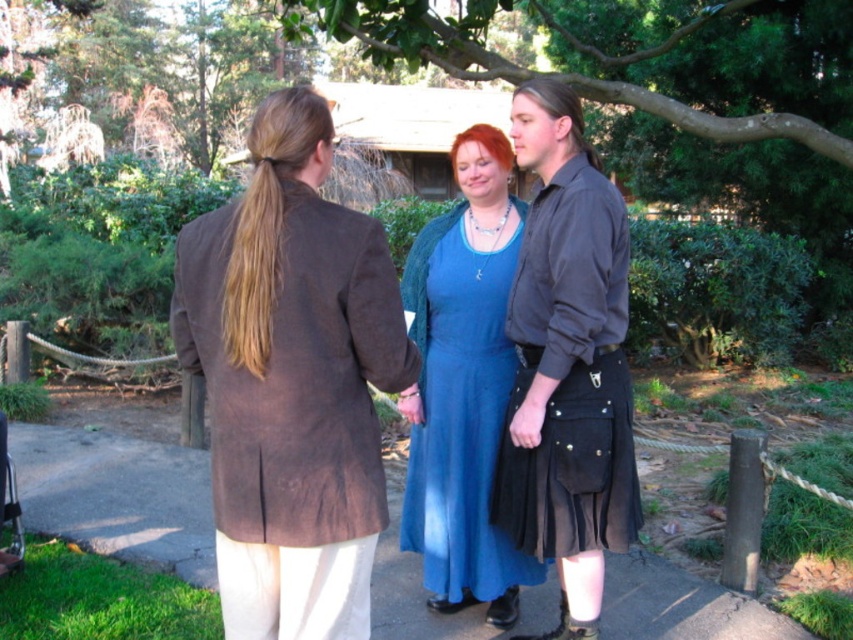
You are a tailor measuring the distance between two garments in the image. The black leather kilt at center and the matte blue dress at center are both on display. Can you fit a 12 inch ruler between them without overlapping either garment?

The distance between the black leather kilt at center and the matte blue dress at center is 13.17 inches, which is greater than 12 inches. Therefore, the ruler can fit between them without overlapping either garment.

In the scene shown: You are a photographer setting up a shoot in the park. You have a black leather kilt at center and a smooth concrete pavement at center in your frame. Which object should you adjust to ensure both fit within the camera frame? Explain your reasoning based on their sizes.

The black leather kilt at center is bigger than the smooth concrete pavement at center. To ensure both fit within the camera frame, you should adjust the position of the black leather kilt at center since it takes up more space in the frame.